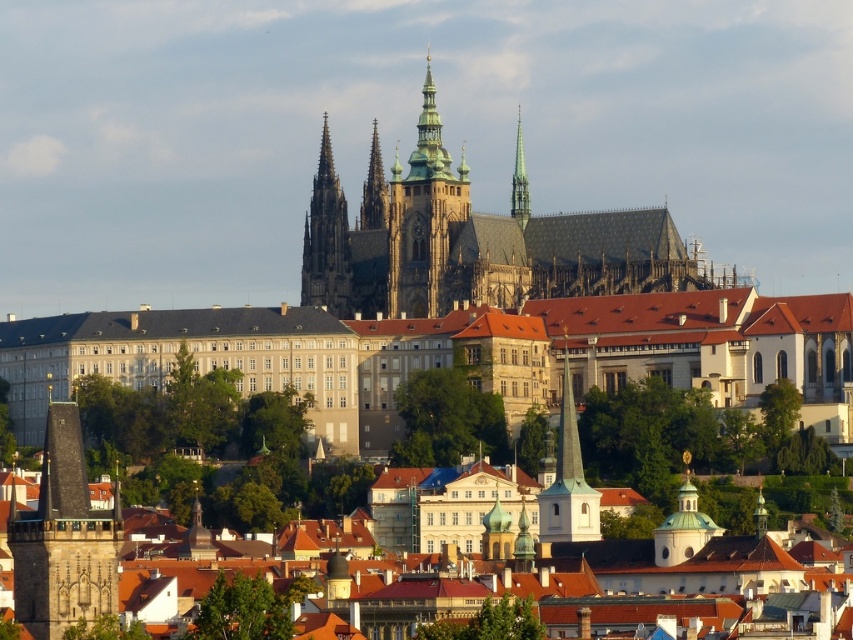
You are standing in the historic cityscape of Prague, looking at the dark gray stone tower at left and the green glass spire at upper center. Which object is positioned to the left of the other?

The dark gray stone tower at left is positioned to the left of the green glass spire at upper center.